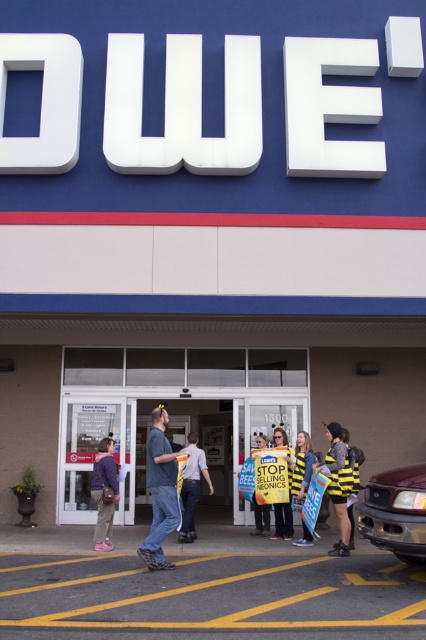
You are a pedestrian standing at the entrance of the Lowe store. You see a matte red truck at lower right and a bee costume at center. Which object is bigger in size?

The matte red truck at lower right is larger in size compared to the bee costume at center.